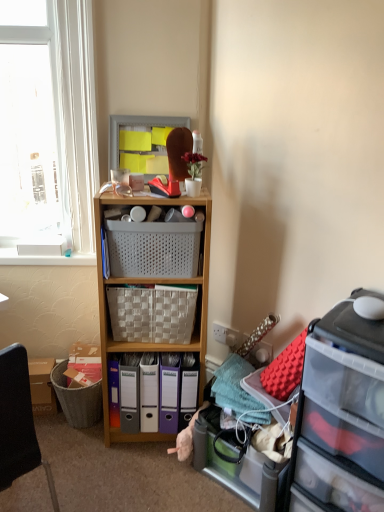
Question: Is point (125, 164) closer or farther from the camera than point (271, 503)?

Choices:
 (A) farther
 (B) closer

Answer: (A)

Question: Is matte plastic cabinet at upper center spatially inside translucent plastic storage box at lower right, or outside of it?

Choices:
 (A) inside
 (B) outside

Answer: (B)

Question: Based on their relative distances, which object is farther from the black leather chair at lower left?

Choices:
 (A) white plastic power outlet at center
 (B) translucent plastic storage box at lower right
 (C) clear plastic drawer at right
 (D) matte plastic bin at center, the second bin in the left-to-right sequence
 (E) white matte vase at upper center

Answer: (A)

Question: Which is farther from the gray textured trash bin at lower left?

Choices:
 (A) matte plastic bin at center, which appears as the 1th bin when viewed from the left
 (B) matte plastic cabinet at upper center
 (C) purple plastic file folders at lower center, placed as the first bin when sorted from right to left
 (D) white plastic power outlet at center
 (E) clear plastic drawer at right

Answer: (B)